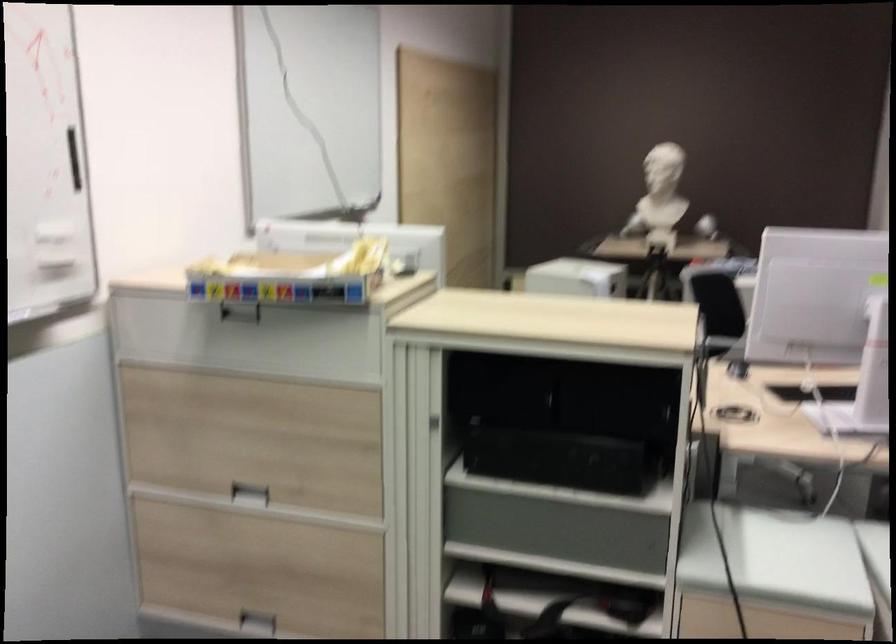
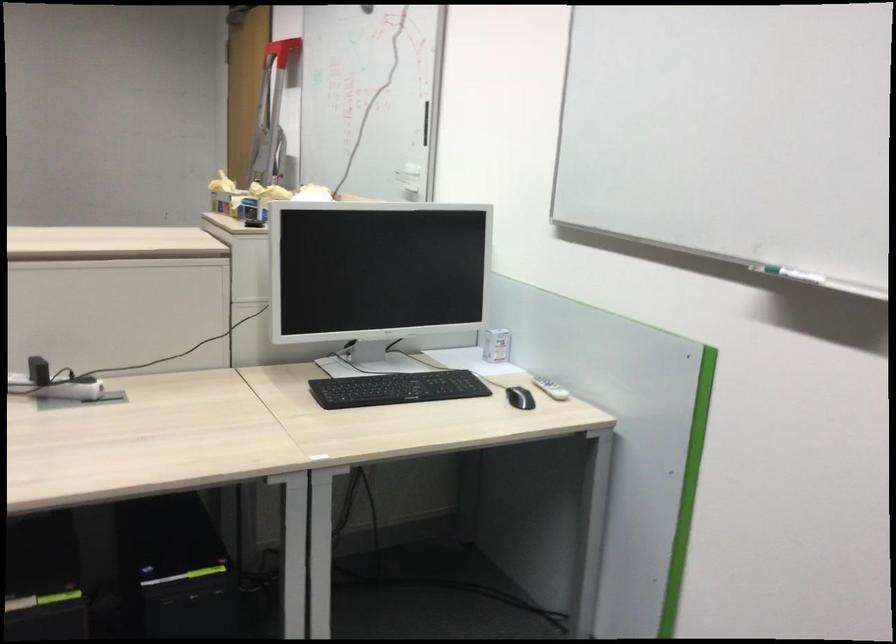
Question: I am providing you with two images of the same scene from different viewpoints. Please identify which objects are invisible in image2.

Choices:
 (A) black computer mouse
 (B) small white box
 (C) small toy bus
 (D) recessed drawer handle

Answer: (D)